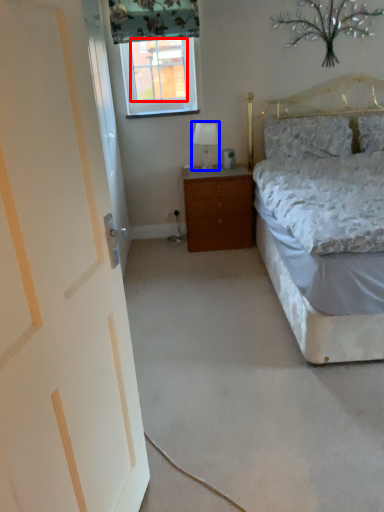
Question: Which object appears farthest to the camera in this image, window screen (highlighted by a red box) or table lamp (highlighted by a blue box)?

Choices:
 (A) window screen
 (B) table lamp

Answer: (A)